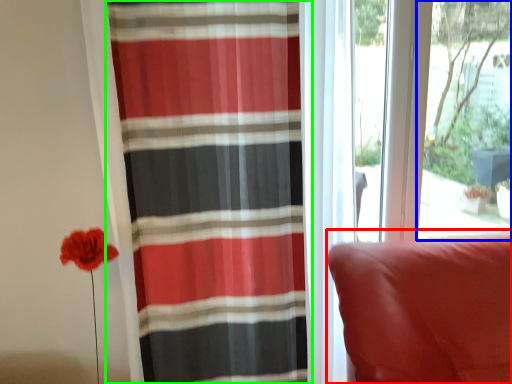
Question: Which object is positioned farthest from furniture (highlighted by a red box)? Select from window screen (highlighted by a blue box) and curtain (highlighted by a green box).

Choices:
 (A) window screen
 (B) curtain

Answer: (A)